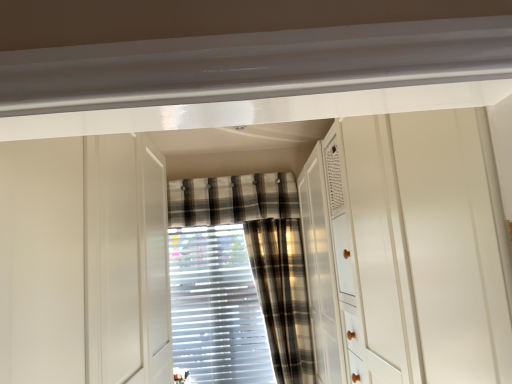
What are the coordinates of `free space above plaid fabric curtain at center, the third curtain from the back (from a real-world perspective)` in the screenshot? It's located at (271, 212).